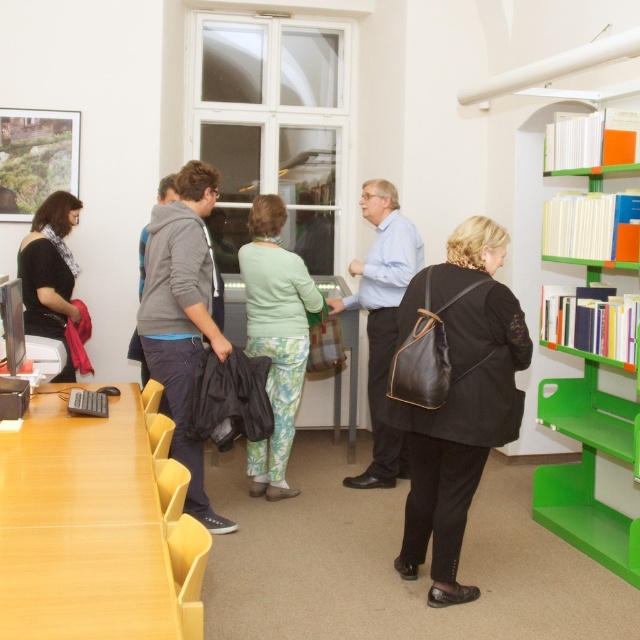
Question: From the image, what is the correct spatial relationship of green plastic bookshelf at right in relation to gray hoodie at center?

Choices:
 (A) above
 (B) below

Answer: (B)

Question: Does black leather backpack at center have a greater width compared to light blue shirt at center?

Choices:
 (A) yes
 (B) no

Answer: (B)

Question: Based on their relative distances, which object is nearer to the gray fleece jacket at center?

Choices:
 (A) gray hoodie at center
 (B) light blue shirt at center
 (C) green floral pants at center

Answer: (A)

Question: Is hardcover book at right below gray fleece jacket at center?

Choices:
 (A) no
 (B) yes

Answer: (B)

Question: Which object appears closest to the camera in this image?

Choices:
 (A) hardcover book at right
 (B) green plastic bookshelf at right
 (C) light blue shirt at center
 (D) green floral pants at center

Answer: (B)

Question: Which object appears farthest from the camera in this image?

Choices:
 (A) orange matte book at upper right
 (B) matte black jacket at left
 (C) hardcover books at right
 (D) gray fleece jacket at center

Answer: (D)